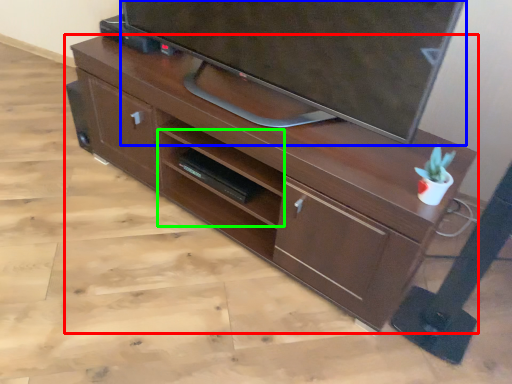
Question: Considering the real-world distances, which object is closest to desk (highlighted by a red box)? television (highlighted by a blue box) or shelf (highlighted by a green box).

Choices:
 (A) television
 (B) shelf

Answer: (B)